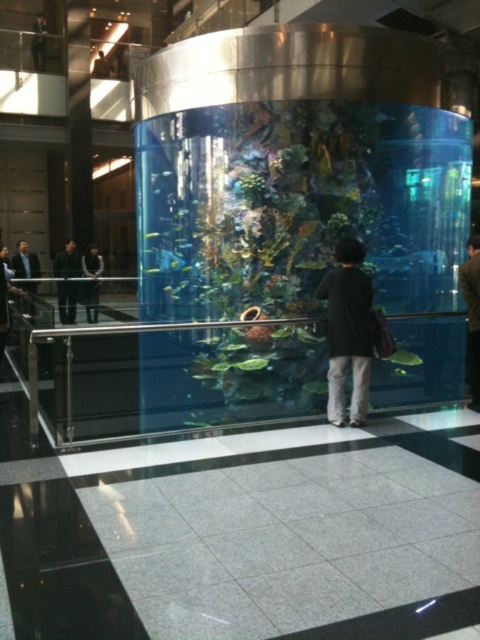
Is black matte jacket at center to the right of dark gray suit at left from the viewer's perspective?

Yes, black matte jacket at center is to the right of dark gray suit at left.

Which is more to the left, black matte jacket at center or dark gray suit at left?

dark gray suit at left

You are a GUI agent. You are given a task and a screenshot of the screen. Output one action in this format:
    pyautogui.click(x=<x>, y=<y>)
    Task: Click on the black matte jacket at center
    
    Given the screenshot: What is the action you would take?
    pyautogui.click(x=348, y=332)

Is black matte jacket at center below black matte suit at left?

Yes, black matte jacket at center is below black matte suit at left.

Can you confirm if black matte jacket at center is bigger than black matte suit at left?

No.

Is point (369, 362) behind point (62, 276)?

No, (369, 362) is in front of (62, 276).

Locate an element on the screen. The image size is (480, 640). black matte jacket at center is located at coordinates (348, 332).

Is black matte jacket at center positioned behind dark brown leather jacket at right?

That is False.

This screenshot has height=640, width=480. I want to click on black matte jacket at center, so click(x=348, y=332).

Between point (370, 301) and point (469, 284), which one is positioned in front?

Point (370, 301)

Locate an element on the screen. This screenshot has height=640, width=480. black matte jacket at center is located at coordinates (348, 332).